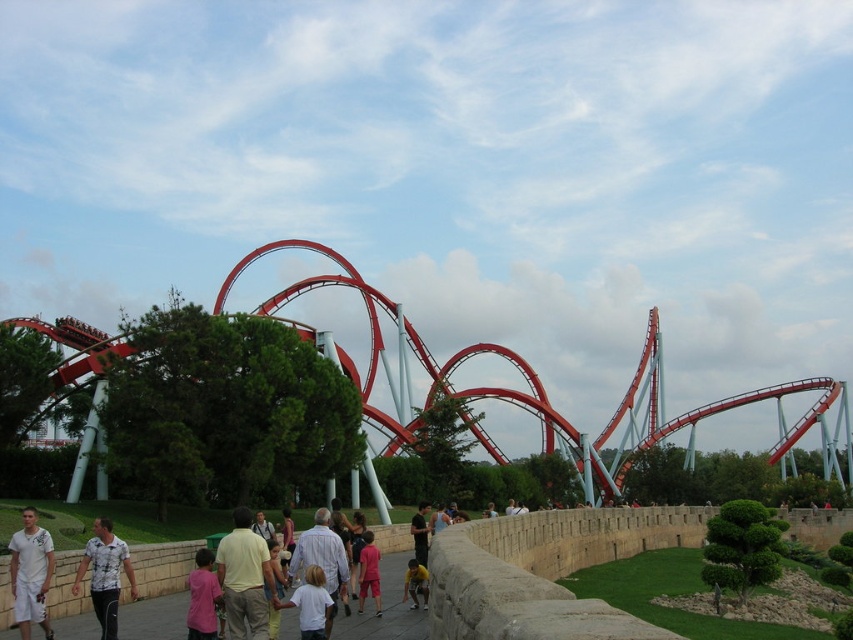
Is white stone pathway at center shorter than white cotton shirt at center?

In fact, white stone pathway at center may be taller than white cotton shirt at center.

Who is more distant from viewer, (x=387, y=636) or (x=305, y=592)?

The point (x=387, y=636) is more distant.

The width and height of the screenshot is (853, 640). Describe the element at coordinates (386, 609) in the screenshot. I see `white stone pathway at center` at that location.

Where is `white stone pathway at center`? Image resolution: width=853 pixels, height=640 pixels. white stone pathway at center is located at coordinates (386, 609).

Does light yellow shirt at center have a greater width compared to white cotton shirt at lower left?

In fact, light yellow shirt at center might be narrower than white cotton shirt at lower left.

Who is more forward, (248, 509) or (35, 544)?

Point (35, 544) is more forward.

Find the location of `light yellow shirt at center`. light yellow shirt at center is located at coordinates (244, 579).

Does point (102, 627) come farther from viewer compared to point (416, 545)?

That is False.

Is white printed shirt at lower left behind black shirt at center?

No, it is in front of black shirt at center.

You are a GUI agent. You are given a task and a screenshot of the screen. Output one action in this format:
    pyautogui.click(x=<x>, y=<y>)
    Task: Click on the white printed shirt at lower left
    Image resolution: width=853 pixels, height=640 pixels.
    Given the screenshot: What is the action you would take?
    pyautogui.click(x=105, y=573)